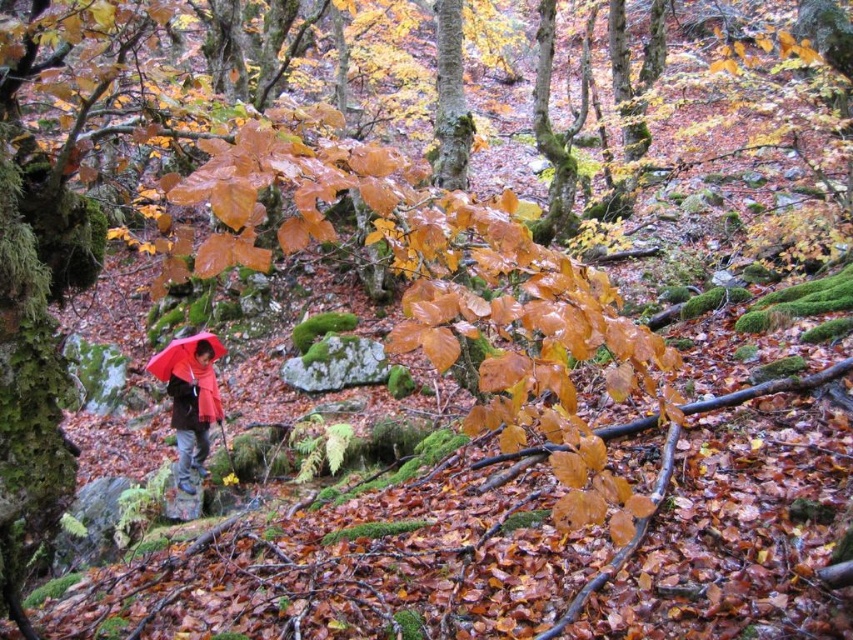
You are a photographer trying to capture the person in the scene. Since both the red matte jacket at center and the matte red umbrella at center are red, how can you ensure the jacket is clearly visible in the photo?

The red matte jacket at center is taller than the matte red umbrella at center, so positioning the camera to focus on the height difference will help distinguish the jacket from the umbrella.